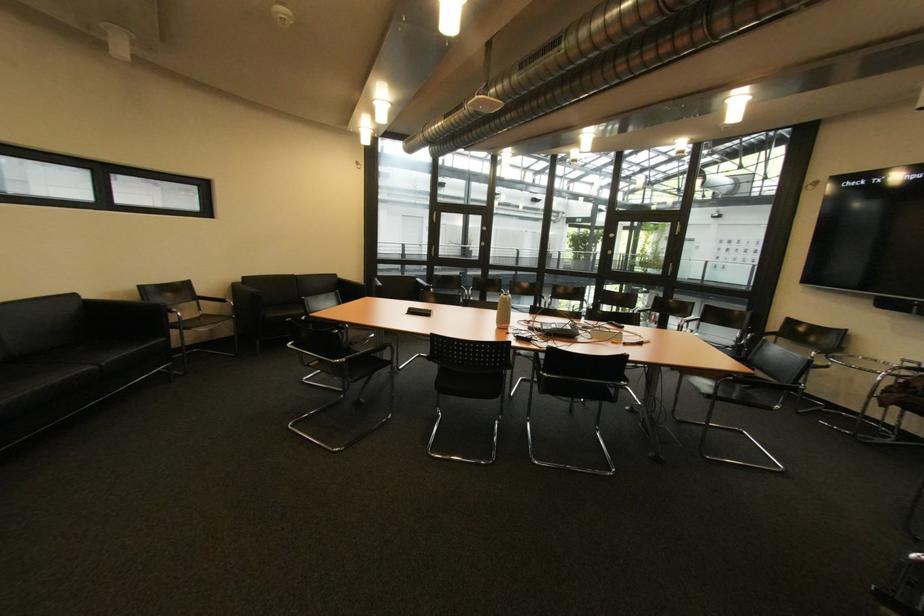
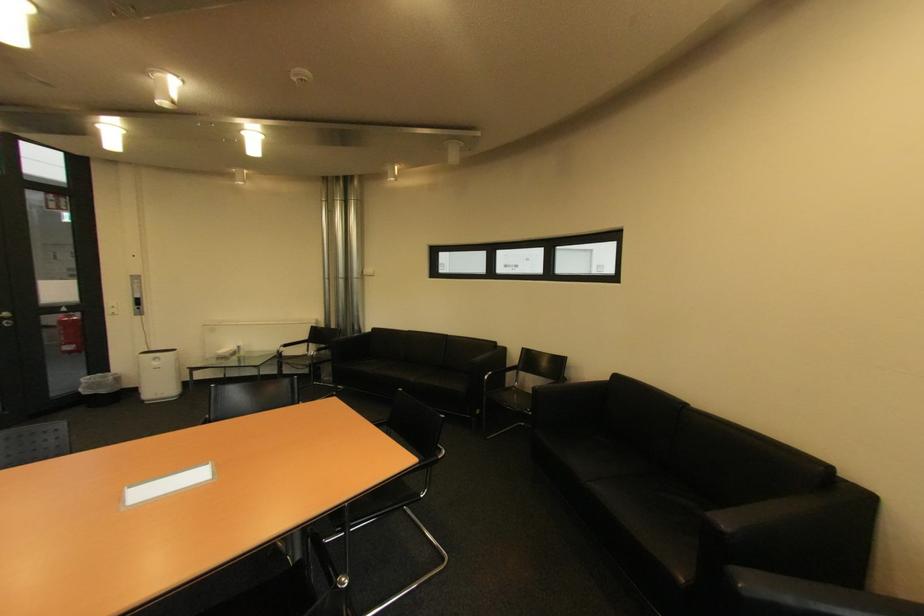
In the second image, find the point that corresponds to point (251, 280) in the first image.

(625, 378)